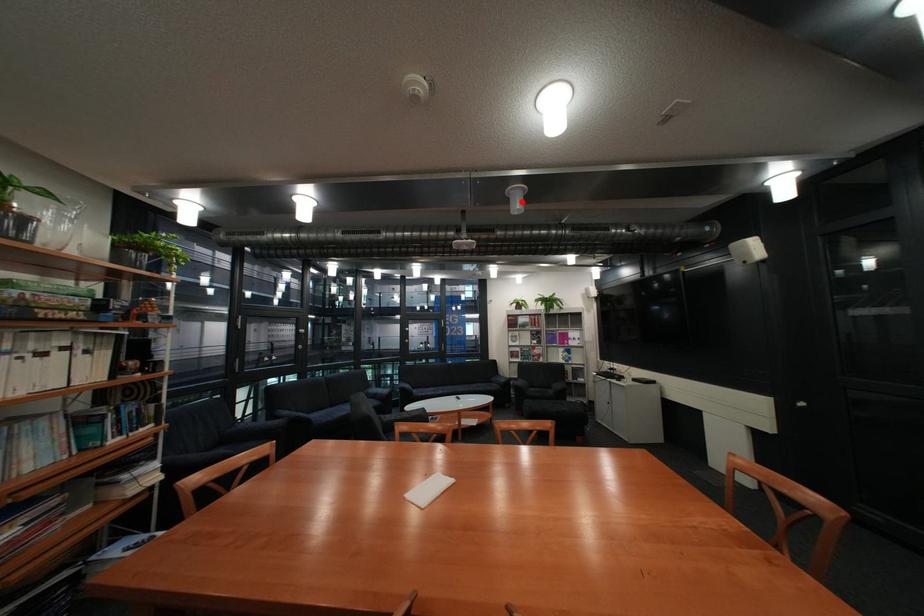
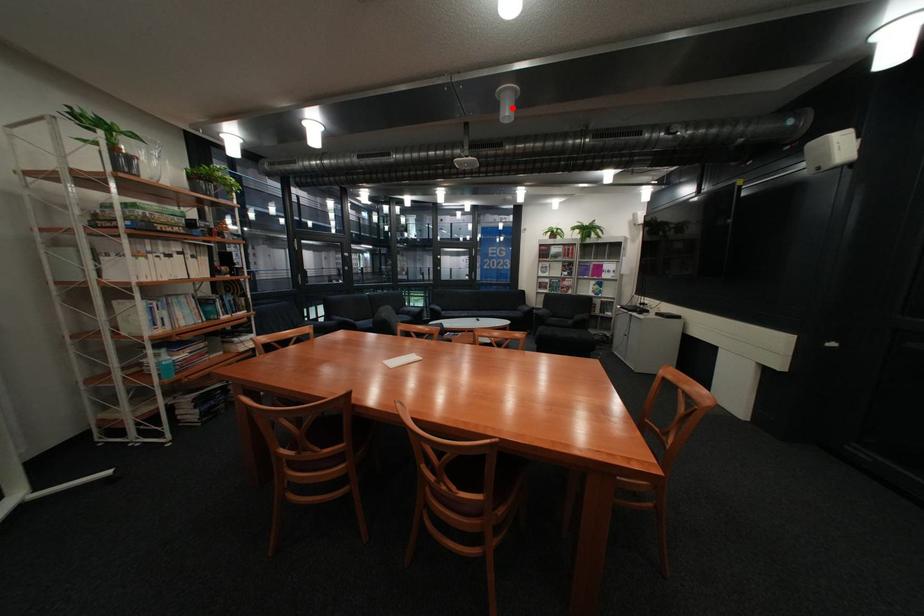
I am providing you with two images of the same scene from different viewpoints. A red point is marked on the first image and another point is marked on the second image. Is the marked point in image1 the same physical position as the marked point in image2?

Yes